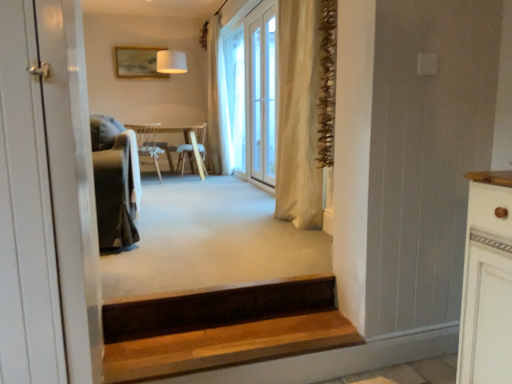
Where is `vacant area situated to the left side of beige fabric curtain at center, which appears as the 2th curtain when viewed from the back`? vacant area situated to the left side of beige fabric curtain at center, which appears as the 2th curtain when viewed from the back is located at coordinates click(237, 223).